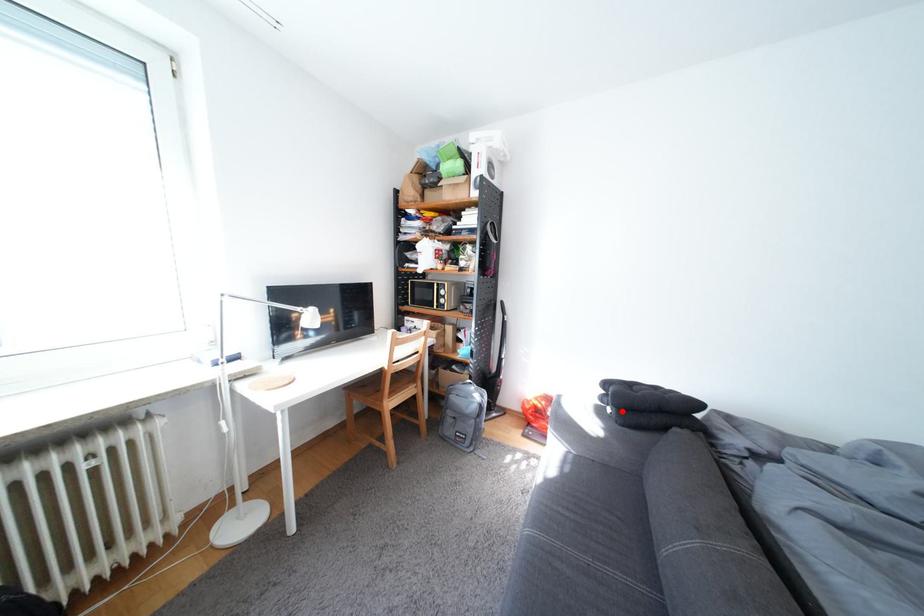
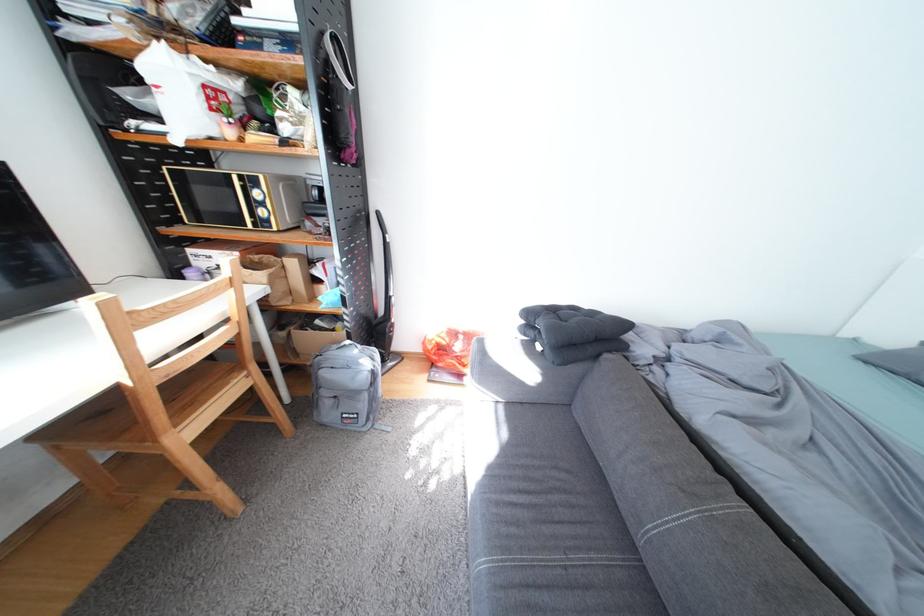
Where in the second image is the point corresponding to the highlighted location from the first image?

(552, 347)